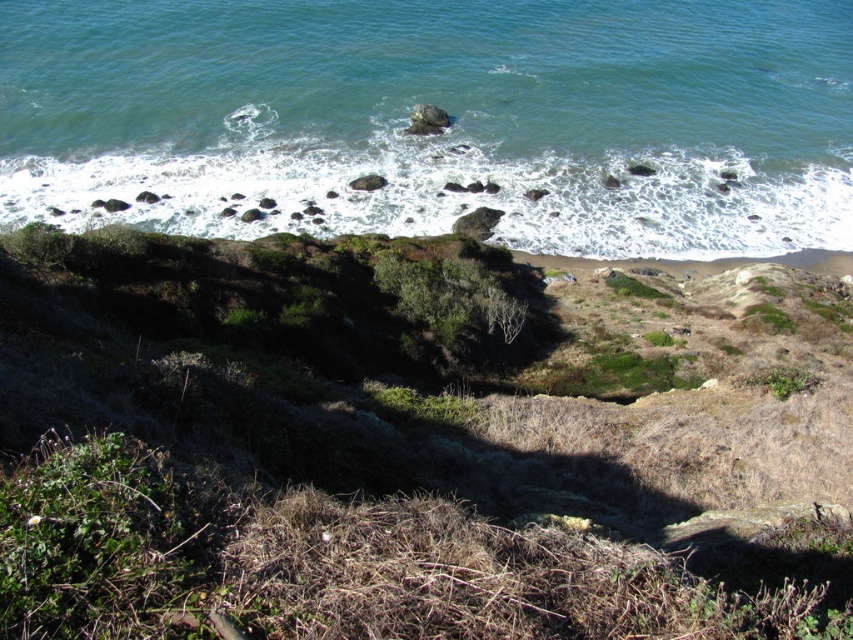
Question: Is green grassy hillside at center below clear blue water at upper center?

Choices:
 (A) no
 (B) yes

Answer: (B)

Question: Is green grassy hillside at center to the right of clear blue water at upper center from the viewer's perspective?

Choices:
 (A) no
 (B) yes

Answer: (A)

Question: Is green grassy hillside at center thinner than clear blue water at upper center?

Choices:
 (A) no
 (B) yes

Answer: (B)

Question: Which point is closer to the camera?

Choices:
 (A) clear blue water at upper center
 (B) green grassy hillside at center

Answer: (B)